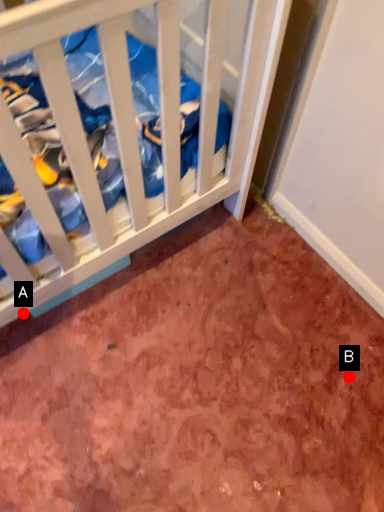
Question: Two points are circled on the image, labeled by A and B beside each circle. Which point is closer to the camera taking this photo?

Choices:
 (A) A is closer
 (B) B is closer

Answer: (A)